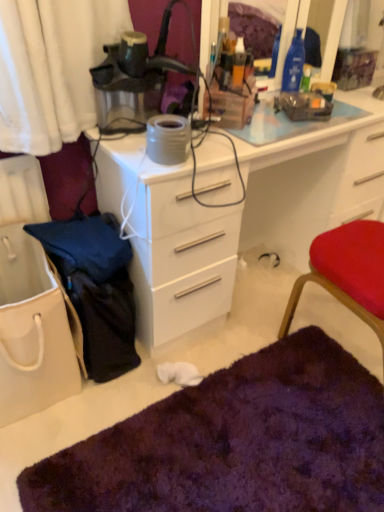
Question: Is point (291, 137) positioned closer to the camera than point (304, 422)?

Choices:
 (A) farther
 (B) closer

Answer: (B)

Question: Considering their positions, is white glossy desk at center located in front of or behind purple shaggy rug at lower center?

Choices:
 (A) behind
 (B) front

Answer: (A)

Question: Which object is positioned closest to the white glossy desk at center?

Choices:
 (A) purple shaggy rug at lower center
 (B) white canvas tote bag at lower left
 (C) matte black lamp at upper center
 (D) clear glass mirror at upper center
 (E) matte gray coffee cup at upper right

Answer: (C)

Question: Based on their relative distances, which object is farther from the matte black lamp at upper center?

Choices:
 (A) white canvas tote bag at lower left
 (B) white glossy desk at center
 (C) purple shaggy rug at lower center
 (D) matte gray coffee cup at upper right
 (E) clear glass mirror at upper center

Answer: (C)